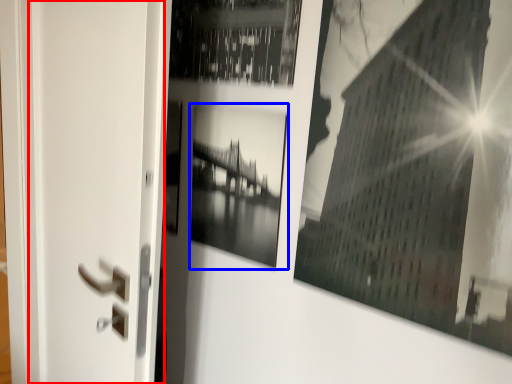
Question: Which of the following is the farthest to the observer, screen door (highlighted by a red box) or picture frame (highlighted by a blue box)?

Choices:
 (A) screen door
 (B) picture frame

Answer: (B)